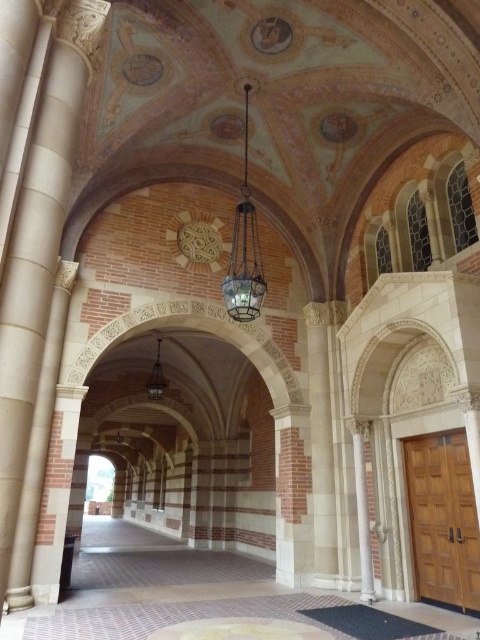
You are a photographer positioned at the camera. You want to take a photo of the white marble column at center. Considering the distance between you and the column, will you need to use a telephoto lens to capture the column in detail?

The white marble column at center and camera are 9.26 meters apart. A telephoto lens is typically used for distant subjects to magnify details. Since the distance is over 9 meters, using a telephoto lens would help capture the column in detail from that distance.

You are standing in the corridor and want to touch both the white marble column at center and the matte brass lamp at center. Which object should you reach for first to touch the one closer to you?

You should reach for the white marble column at center first because it is closer to the viewer than the matte brass lamp at center.

You are an interior designer assessing the corridor. You need to determine if the metallic glass chandelier at center can be lowered so its bottom reaches the same height as the white marble column at center. Is this possible based on their current heights?

The metallic glass chandelier at center is shorter than the white marble column at center, so lowering it further would not make their bottoms align since the column is already taller. The chandelier cannot be lowered enough to match the column height.